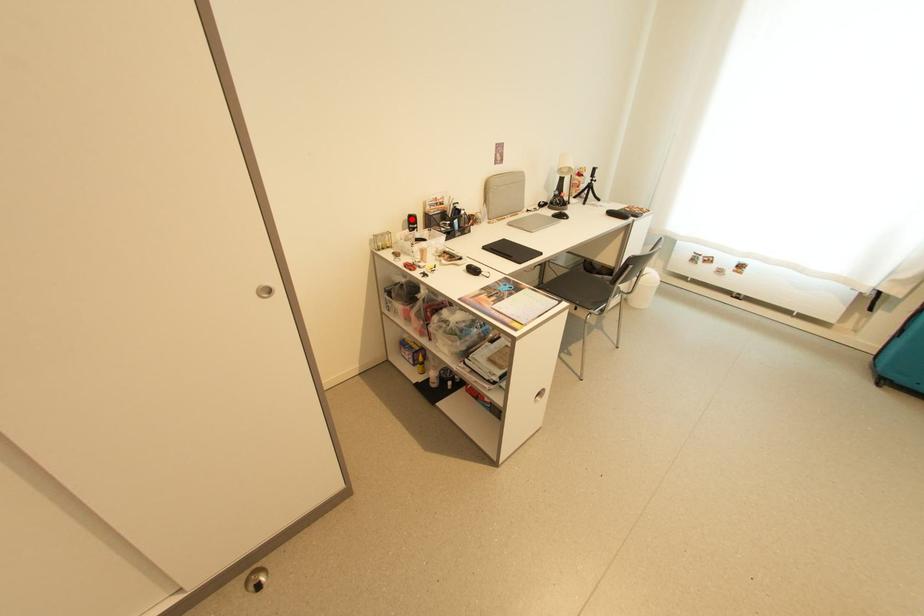
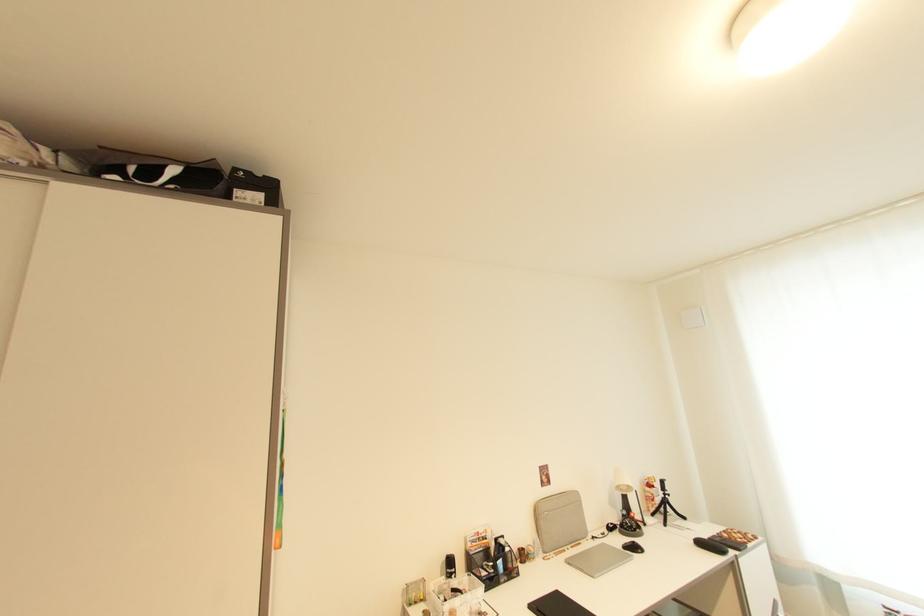
The point at the highlighted location is marked in the first image. Where is the corresponding point in the second image?

(450, 561)